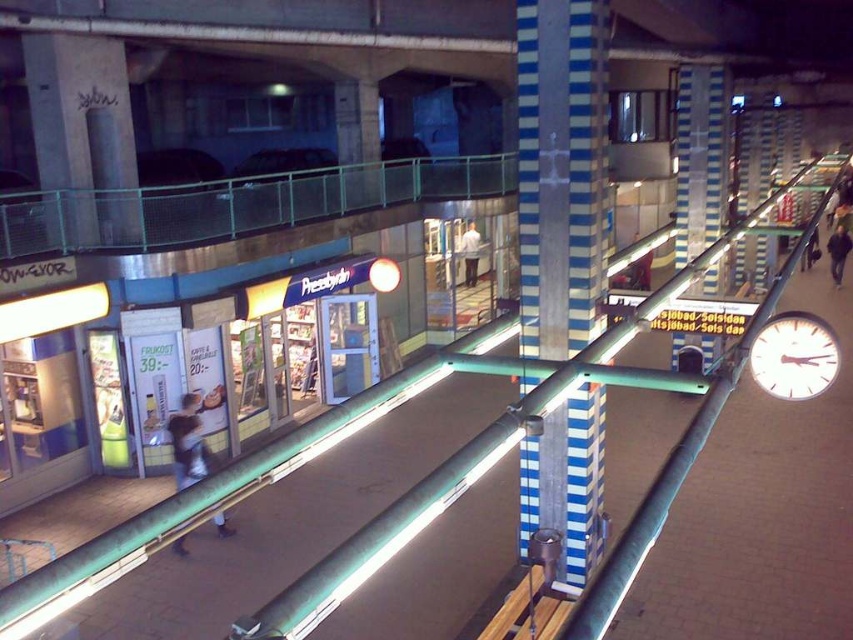
Which is below, denim jacket at lower left or dark blue jacket at lower right?

denim jacket at lower left

Which is behind, point (170, 422) or point (844, 246)?

Positioned behind is point (844, 246).

The width and height of the screenshot is (853, 640). Find the location of `denim jacket at lower left`. denim jacket at lower left is located at coordinates (189, 445).

Can you confirm if white metallic clock at right is wider than white matte shirt at center?

Yes.

Between point (816, 392) and point (479, 237), which one is positioned in front?

Point (816, 392)

Is point (779, 340) more distant than point (473, 228)?

No.

This screenshot has height=640, width=853. What are the coordinates of `white metallic clock at right` in the screenshot? It's located at (793, 355).

Does denim jacket at lower left have a greater height compared to white matte shirt at center?

Indeed, denim jacket at lower left has a greater height compared to white matte shirt at center.

Which of these two, denim jacket at lower left or white matte shirt at center, stands shorter?

With less height is white matte shirt at center.

Who is more distant from viewer, (190, 428) or (473, 282)?

Positioned behind is point (473, 282).

The image size is (853, 640). Identify the location of denim jacket at lower left. (189, 445).